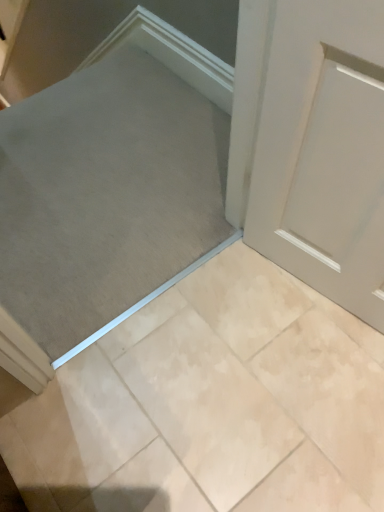
The width and height of the screenshot is (384, 512). I want to click on free point above gray fabric at center (from a real-world perspective), so click(111, 165).